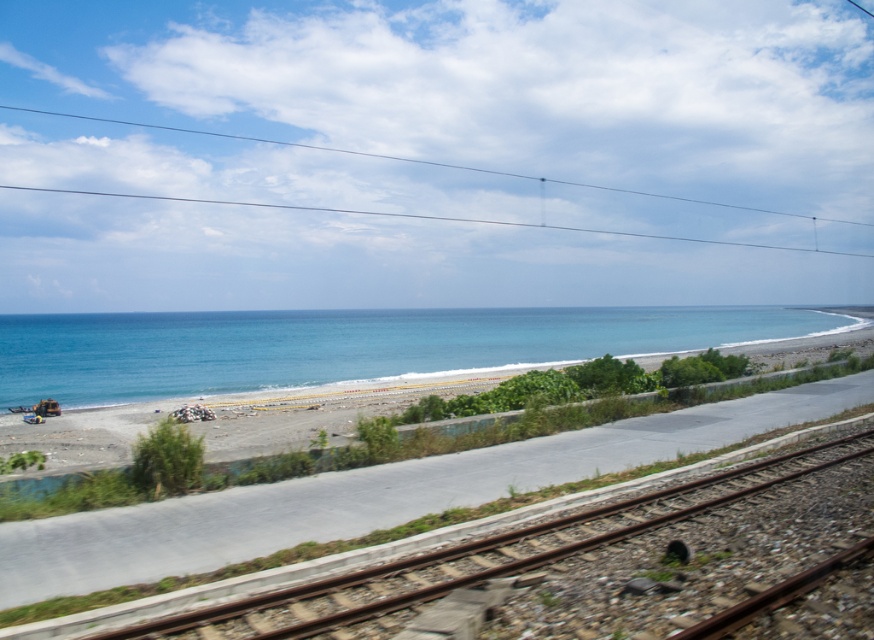
In the scene shown: You are a photographer trying to capture the smooth sand beach at lower left and the brown rusted metal track at lower center in a single shot. Based on their heights, which object will appear larger in the photo?

The smooth sand beach at lower left will appear larger in the photo because it has a greater height compared to the brown rusted metal track at lower center.

You are standing at the point labeled point (81, 396) and want to walk to the ocean. The railway tracks are 173.79 feet away from you. Is there enough space between the tracks and the pathway to safely walk around them?

The railway tracks are 173.79 feet away from the point labeled point (81, 396). Since the pathway is paved and runs parallel to the tracks, there should be sufficient space between them to safely walk around the tracks towards the ocean.

In the scene shown: You are a photographer planning to capture a wide landscape shot of the smooth sand beach at lower left and the blue glossy water at left. Given their widths, which area would require you to adjust your camera angle to include more of its expanse in the photo?

The blue glossy water at left requires adjusting the camera angle to include more of its expanse since it has a greater width than the smooth sand beach at lower left.